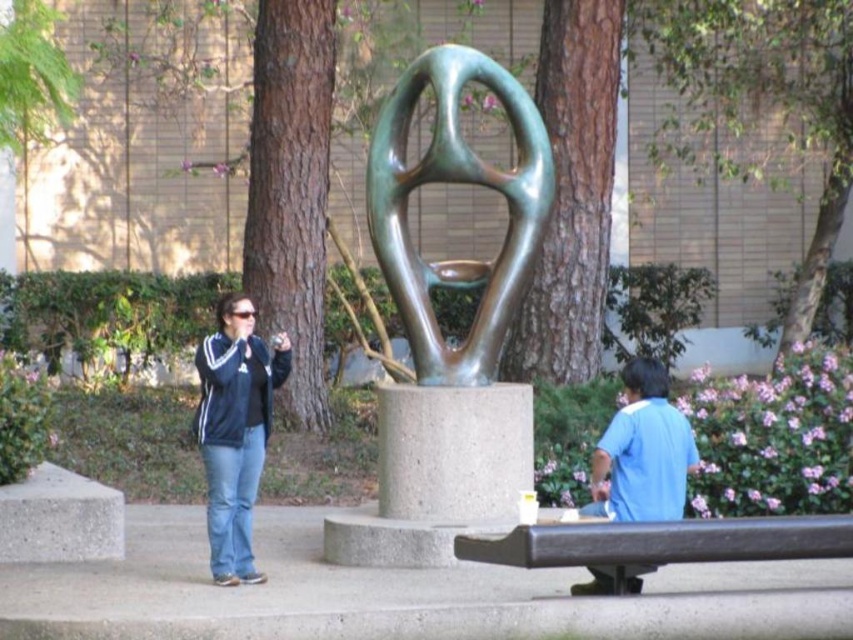
Question: Is black metal bench at lower right in front of blue cotton shirt at lower right?

Choices:
 (A) no
 (B) yes

Answer: (B)

Question: Can you confirm if green patina bronze abstract at center is bigger than black metal bench at lower right?

Choices:
 (A) no
 (B) yes

Answer: (B)

Question: Which of the following is the farthest from the observer?

Choices:
 (A) (500, 317)
 (B) (251, 317)
 (C) (608, 467)

Answer: (A)

Question: Among these objects, which one is nearest to the camera?

Choices:
 (A) blue cotton shirt at lower right
 (B) green patina bronze abstract at center
 (C) black metal bench at lower right

Answer: (C)

Question: Does green patina bronze abstract at center have a lesser width compared to black metal bench at lower right?

Choices:
 (A) no
 (B) yes

Answer: (B)

Question: Among these objects, which one is farthest from the camera?

Choices:
 (A) black metal bench at lower right
 (B) green patina bronze abstract at center
 (C) blue cotton shirt at lower right
 (D) matte black jacket at center left

Answer: (B)